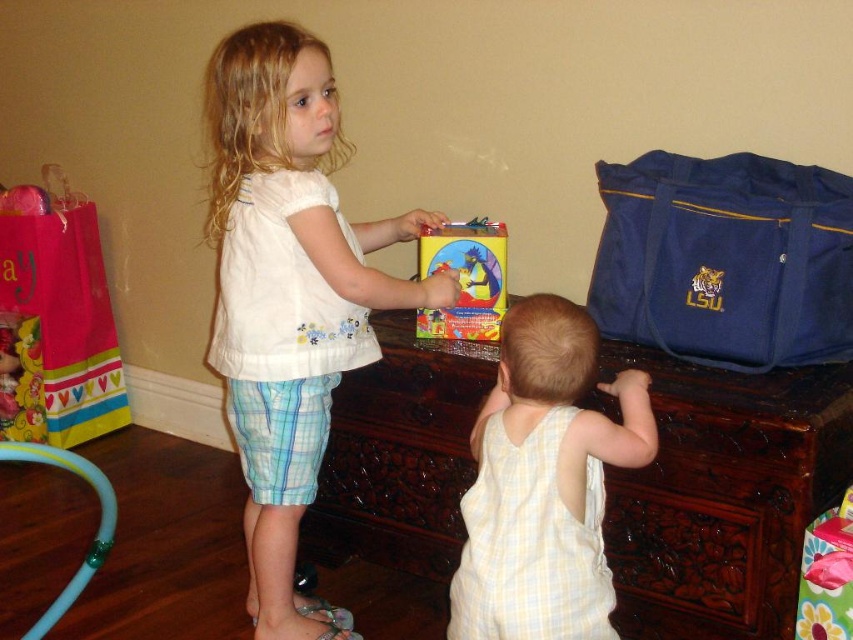
Question: Can you confirm if brown carved wood chest at center is positioned above light yellow checkered onesie at center?

Choices:
 (A) yes
 (B) no

Answer: (B)

Question: Estimate the real-world distances between objects in this image. Which object is farther from the light yellow checkered onesie at center?

Choices:
 (A) white cotton shirt at center
 (B) brown carved wood chest at center
 (C) matte plastic book at center

Answer: (A)

Question: Among these objects, which one is nearest to the camera?

Choices:
 (A) light yellow checkered onesie at center
 (B) brown carved wood chest at center
 (C) matte plastic book at center

Answer: (A)

Question: In this image, where is brown carved wood chest at center located relative to white cotton shirt at center?

Choices:
 (A) right
 (B) left

Answer: (A)

Question: In this image, where is white cotton shirt at center located relative to matte plastic book at center?

Choices:
 (A) right
 (B) left

Answer: (B)

Question: Which point is farther to the camera?

Choices:
 (A) (544, 552)
 (B) (839, 365)
 (C) (483, 228)
 (D) (305, 76)

Answer: (C)